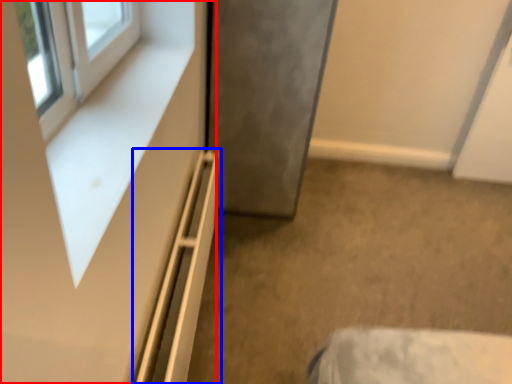
Question: Among these objects, which one is farthest to the camera, dresser (highlighted by a red box) or shelf (highlighted by a blue box)?

Choices:
 (A) dresser
 (B) shelf

Answer: (B)